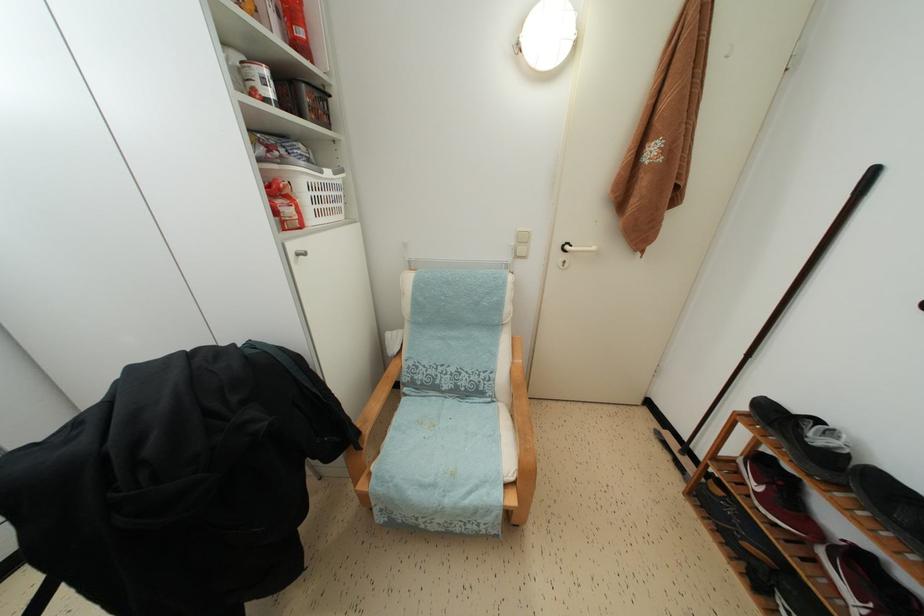
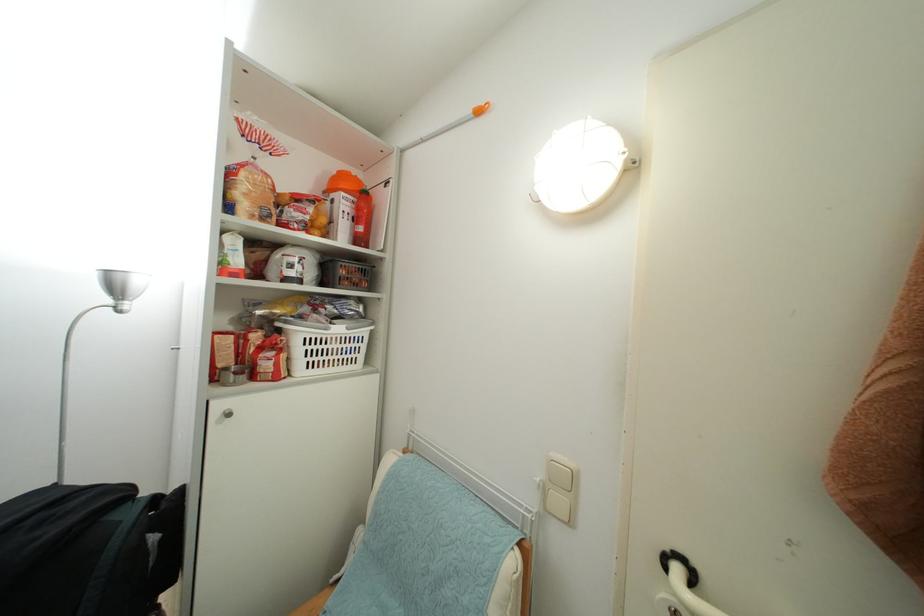
Question: I am providing you with two images of the same scene from different viewpoints. Please identify which objects are invisible in image2.

Choices:
 (A) white door handle
 (B) red food package
 (C) red plastic bottle
 (D) none of these

Answer: (D)